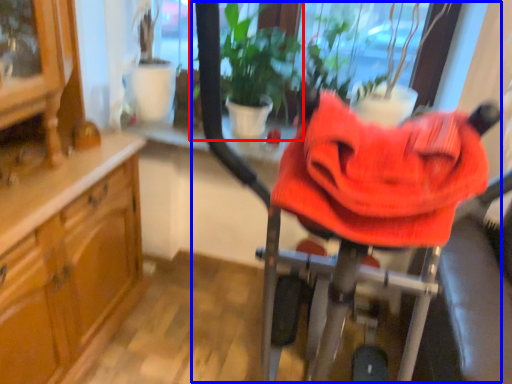
Question: Which object appears closest to the camera in this image, houseplant (highlighted by a red box) or baby carriage (highlighted by a blue box)?

Choices:
 (A) houseplant
 (B) baby carriage

Answer: (B)